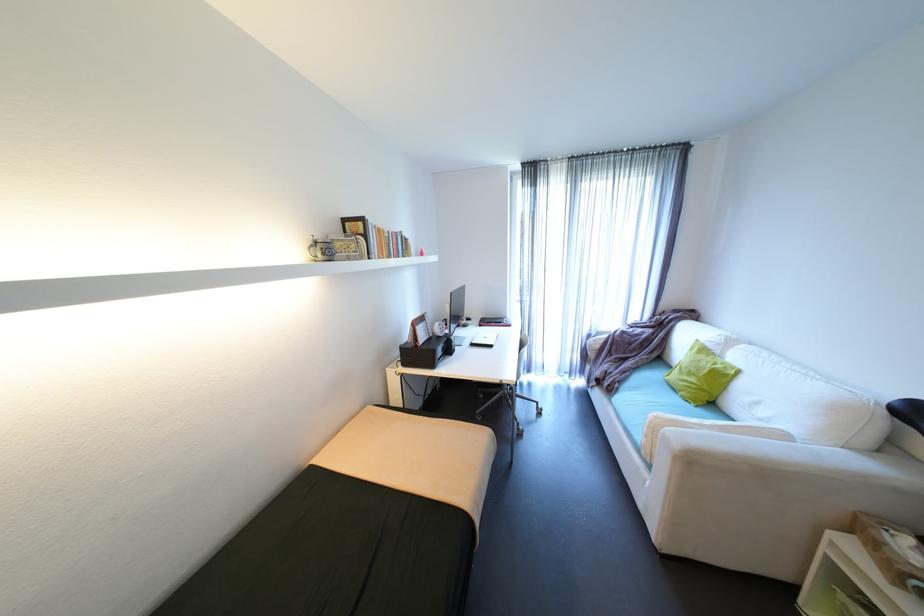
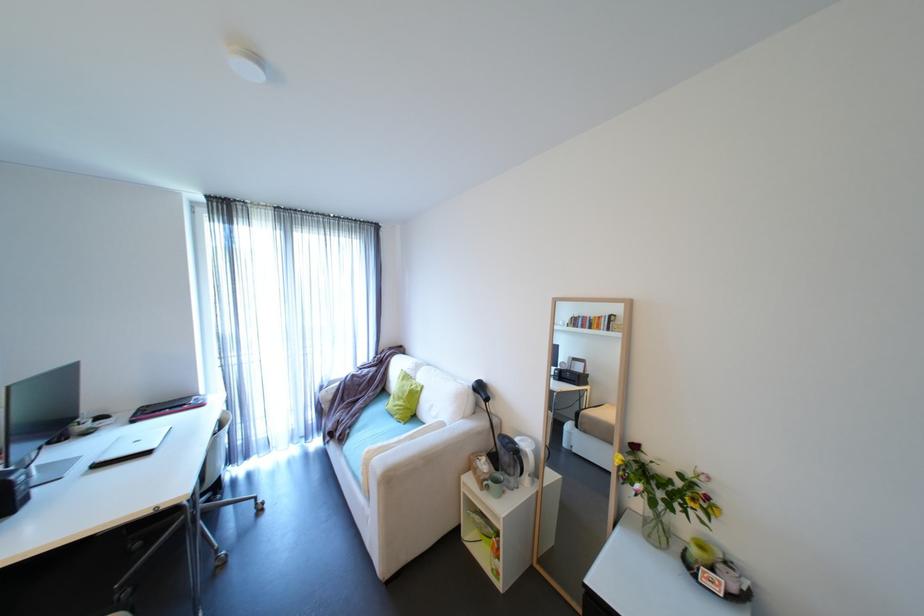
The point at (601, 334) is marked in the first image. Where is the corresponding point in the second image?

(333, 386)